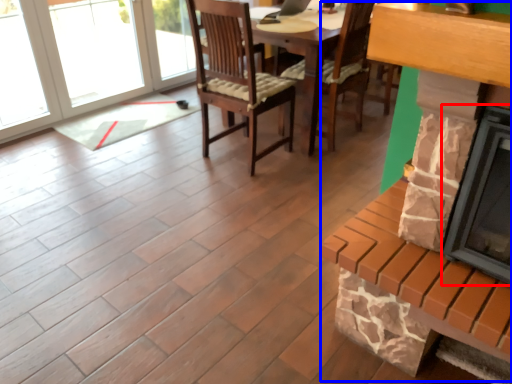
Question: Which object appears farthest to the camera in this image, fireplace (highlighted by a red box) or fireplace (highlighted by a blue box)?

Choices:
 (A) fireplace
 (B) fireplace

Answer: (B)